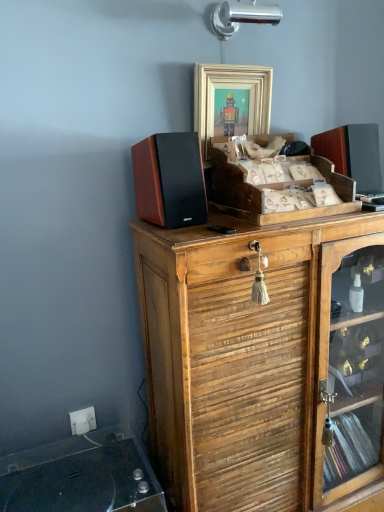
Question: Is clear glass record player at lower left turned away from white plastic electric outlet at lower left?

Choices:
 (A) no
 (B) yes

Answer: (B)

Question: Are clear glass record player at lower left and white plastic electric outlet at lower left far apart?

Choices:
 (A) no
 (B) yes

Answer: (A)

Question: Is clear glass record player at lower left not inside white plastic electric outlet at lower left?

Choices:
 (A) no
 (B) yes

Answer: (B)

Question: From the image's perspective, is clear glass record player at lower left over white plastic electric outlet at lower left?

Choices:
 (A) yes
 (B) no

Answer: (B)

Question: Does clear glass record player at lower left have a smaller size compared to white plastic electric outlet at lower left?

Choices:
 (A) no
 (B) yes

Answer: (A)

Question: From a real-world perspective, is white plastic electric outlet at lower left physically located above or below wooden cabinet at upper center, which ranks as the 2th cabinetry in top-to-bottom order?

Choices:
 (A) above
 (B) below

Answer: (B)

Question: Based on their positions, is white plastic electric outlet at lower left located to the left or right of wooden cabinet at upper center, which ranks as the 2th cabinetry in top-to-bottom order?

Choices:
 (A) left
 (B) right

Answer: (A)

Question: Is white plastic electric outlet at lower left wider or thinner than wooden cabinet at upper center, which is counted as the 1th cabinetry, starting from the bottom?

Choices:
 (A) thin
 (B) wide

Answer: (A)

Question: Considering the positions of white plastic electric outlet at lower left and wooden cabinet at upper center, which ranks as the 2th cabinetry in top-to-bottom order, in the image, is white plastic electric outlet at lower left taller or shorter than wooden cabinet at upper center, which ranks as the 2th cabinetry in top-to-bottom order,?

Choices:
 (A) tall
 (B) short

Answer: (B)

Question: From a real-world perspective, is gold-toned wooden frame at upper center above or below clear glass record player at lower left?

Choices:
 (A) above
 (B) below

Answer: (A)

Question: Considering the positions of point click(x=213, y=119) and point click(x=92, y=431), is point click(x=213, y=119) closer or farther from the camera than point click(x=92, y=431)?

Choices:
 (A) farther
 (B) closer

Answer: (B)

Question: Considering the positions of gold-toned wooden frame at upper center and clear glass record player at lower left in the image, is gold-toned wooden frame at upper center taller or shorter than clear glass record player at lower left?

Choices:
 (A) short
 (B) tall

Answer: (B)

Question: Is gold-toned wooden frame at upper center wider or thinner than clear glass record player at lower left?

Choices:
 (A) thin
 (B) wide

Answer: (A)

Question: Considering their positions, is white plastic electric outlet at lower left located in front of or behind gold-toned wooden frame at upper center?

Choices:
 (A) behind
 (B) front

Answer: (A)

Question: Considering the relative positions of white plastic electric outlet at lower left and gold-toned wooden frame at upper center in the image provided, is white plastic electric outlet at lower left to the left or to the right of gold-toned wooden frame at upper center?

Choices:
 (A) right
 (B) left

Answer: (B)